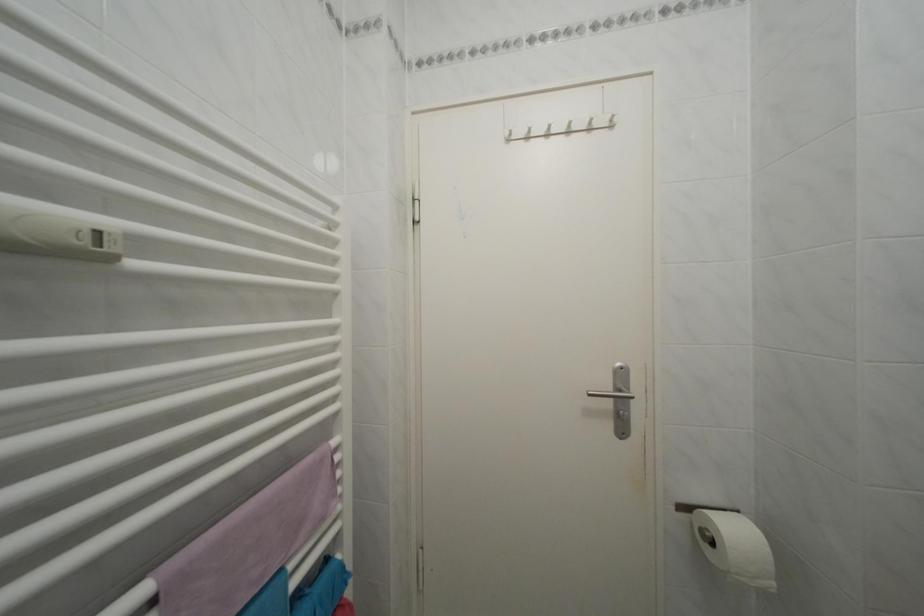
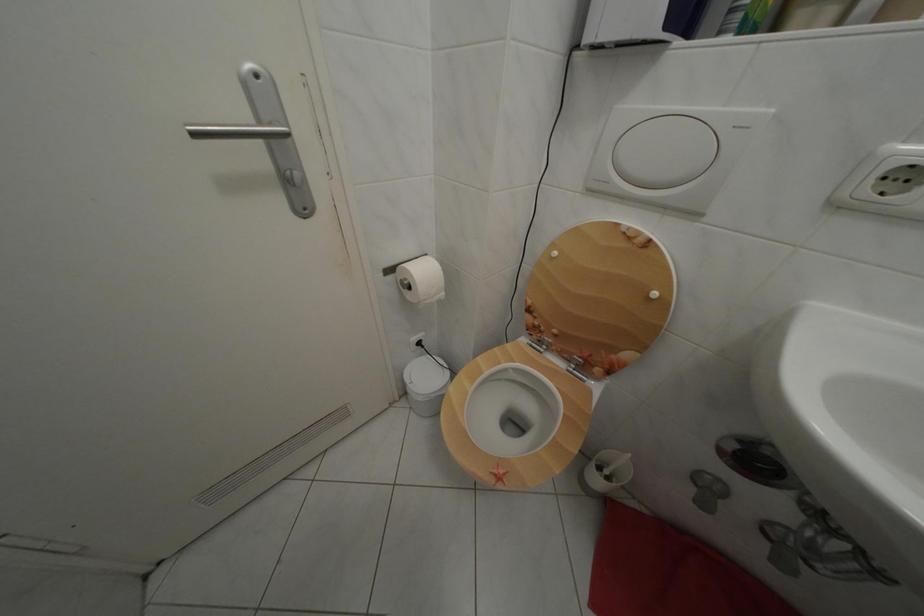
The images are taken continuously from a first-person perspective. In which direction is your viewpoint rotating?

The camera's rotation is toward right-down.